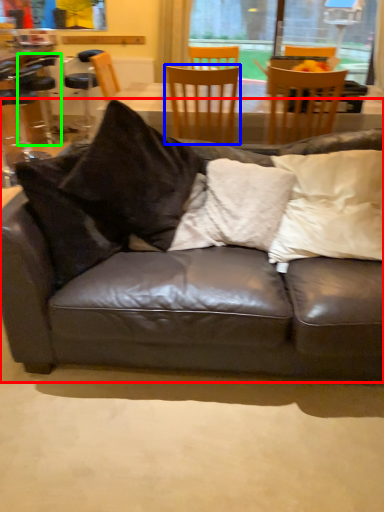
Question: Estimate the real-world distances between objects in this image. Which object is closer to studio couch (highlighted by a red box), chair (highlighted by a blue box) or bar stool (highlighted by a green box)?

Choices:
 (A) chair
 (B) bar stool

Answer: (A)